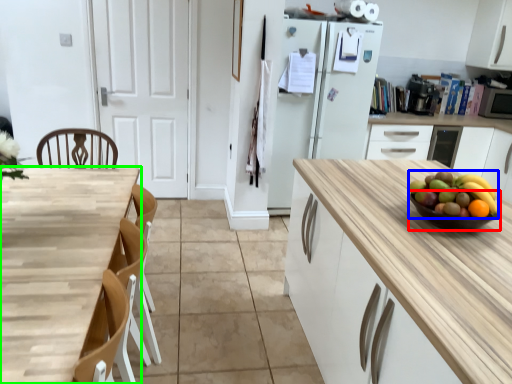
Question: Which object is the farthest from glass bowl (highlighted by a red box)? Choose among these: grapefruit (highlighted by a blue box) or countertop (highlighted by a green box).

Choices:
 (A) grapefruit
 (B) countertop

Answer: (B)